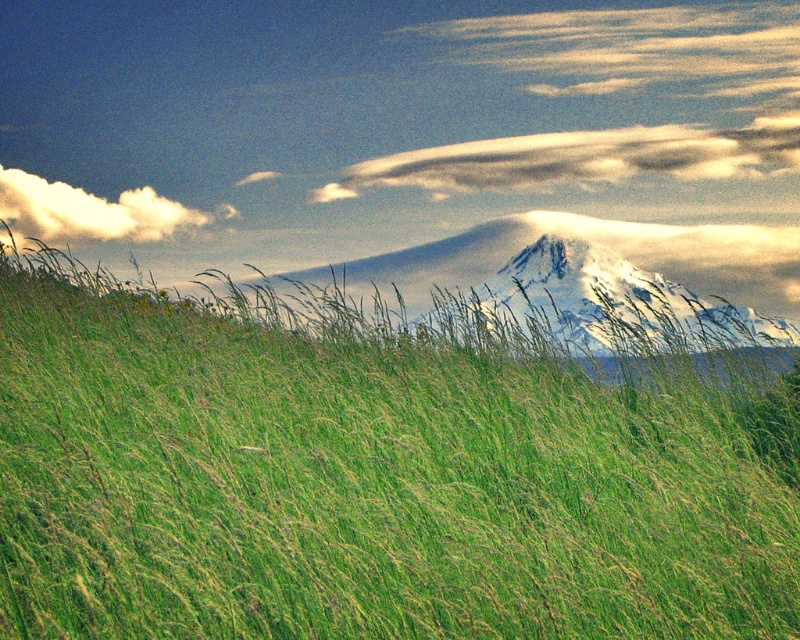
You are standing in the middle of the green grassy hillside at center and want to take a photo of the white fluffy cloud at upper left. Which object will appear larger in your photo?

The green grassy hillside at center will appear larger in your photo because it is closer to the viewer than the white fluffy cloud at upper left.

You are standing in the middle of the green grassy hillside at center and want to look at the white fluffy cloud at upper left. In which direction should you turn your head?

You should turn your head to the left because the green grassy hillside at center is to the right of the white fluffy cloud at upper left, meaning the cloud is located to the left side relative to the hillside.